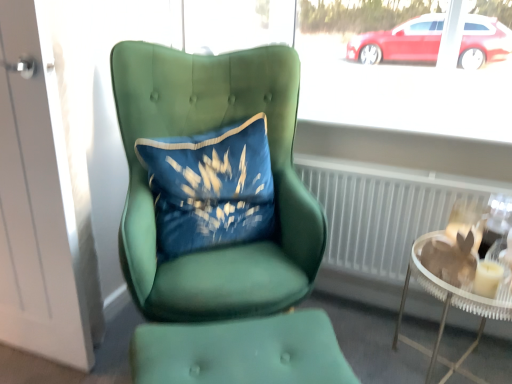
Locate an element on the screen. free point behind white matte door at left is located at coordinates (118, 317).